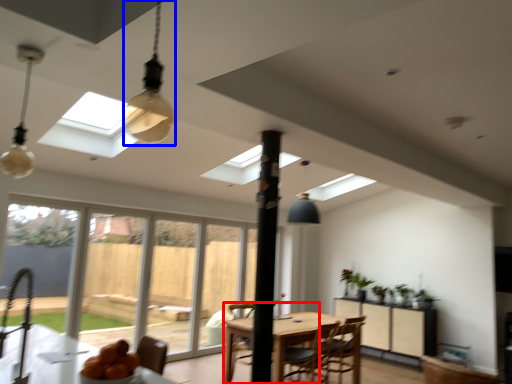
Question: Which object is closer to the camera taking this photo, chair (highlighted by a red box) or light fixture (highlighted by a blue box)?

Choices:
 (A) chair
 (B) light fixture

Answer: (B)